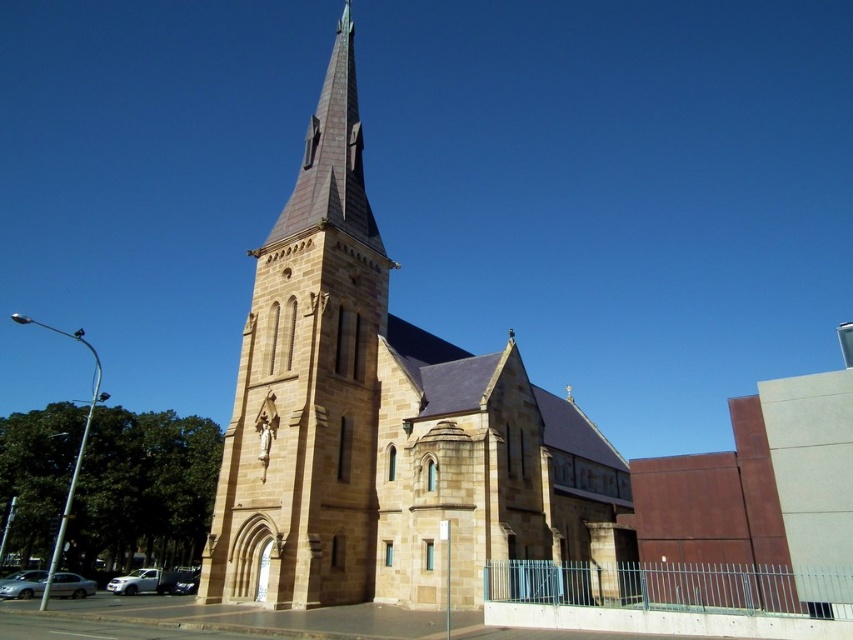
You are standing in front of the brown stone church at center and want to take a photo of the brown stone tower at center. Since the church is blocking your view, where should you move to get an unobstructed view of the tower?

The brown stone church at center is below the brown stone tower at center, so you should move to a higher position to get an unobstructed view of the tower.

You are standing in front of the church and want to determine the distance between two specific points marked on the property. The first point is at coordinates point [216,580] and the second is at point [292,552]. Based on the scene, which point is closer to you?

Point [216,580] is further to the viewer than point [292,552], so the closer point to you is point [292,552].

From the picture: You are a delivery person with a cart that is 8 meters wide. You need to pass between the brown stone church at center and the brown stone tower at center. Is there enough space for your cart to fit through?

The brown stone church at center and brown stone tower at center are 7.97 meters apart from each other, so the cart that is 8 meters wide cannot fit through the space between them.